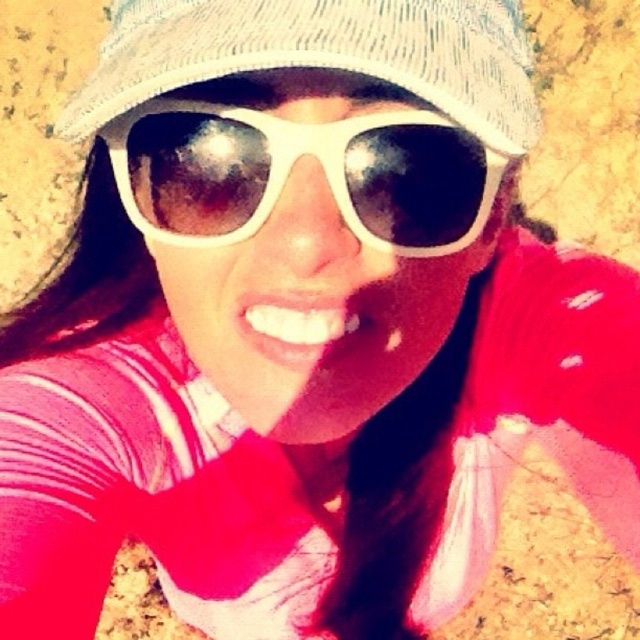
You are a photographer trying to capture a close shot of the person. The camera lens has a maximum focus range of 1.5 inches. If you want to focus on both the white plastic sunglasses at center and the woven fabric baseball hat at upper center, will you be able to do so with this camera?

The white plastic sunglasses at center and the woven fabric baseball hat at upper center are 1.80 inches apart. Since the camera lens has a maximum focus range of 1.5 inches, it cannot focus on both objects simultaneously because the distance between them exceeds the lens capability.

In the scene shown: You are a photographer trying to capture the subject without any obstructions. Since the woven fabric baseball hat at upper center and the white plastic sunglasses at center are both visible, which object is closer to the camera?

The white plastic sunglasses at center are closer to the camera because the woven fabric baseball hat at upper center is behind them.